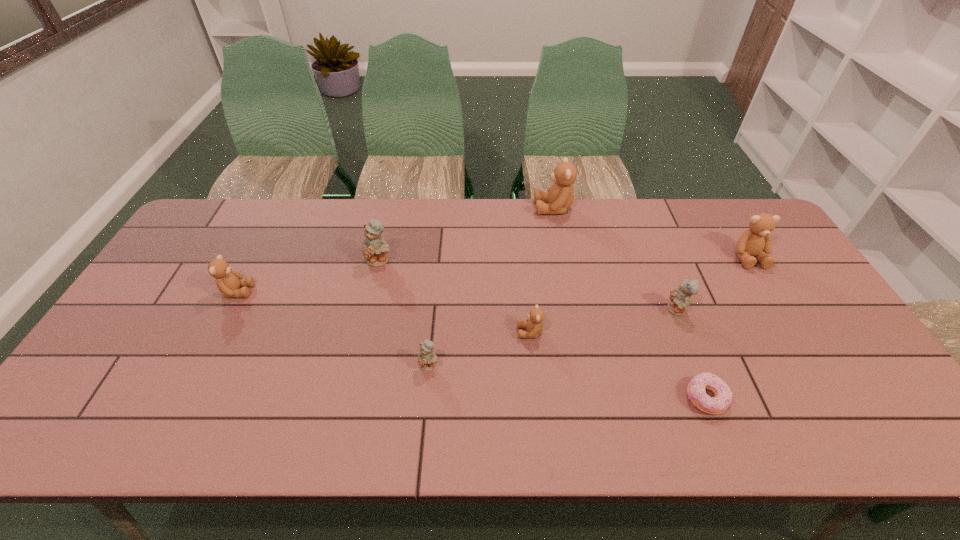
The width and height of the screenshot is (960, 540). Find the location of `vacant space that satisfies the following two spatial constraints: 1. on the face of the doughnut; 2. on the right side of the leftmost object`. vacant space that satisfies the following two spatial constraints: 1. on the face of the doughnut; 2. on the right side of the leftmost object is located at coordinates (182, 399).

Identify the location of free spot that satisfies the following two spatial constraints: 1. on the face of the tallest teddy bear; 2. on the front-facing side of the smallest blue teddy bear. The image size is (960, 540). (583, 365).

At what (x,y) coordinates should I click in order to perform the action: click on blank space that satisfies the following two spatial constraints: 1. on the face of the fifth object from left to right; 2. on the front-facing side of the leftmost blue teddy bear. Please return your answer as a coordinate pair (x, y). The height and width of the screenshot is (540, 960). Looking at the image, I should click on (564, 260).

The width and height of the screenshot is (960, 540). Find the location of `free space in the image that satisfies the following two spatial constraints: 1. on the front-facing side of the nearest object; 2. on the left side of the farthest blue teddy bear`. free space in the image that satisfies the following two spatial constraints: 1. on the front-facing side of the nearest object; 2. on the left side of the farthest blue teddy bear is located at coordinates (348, 399).